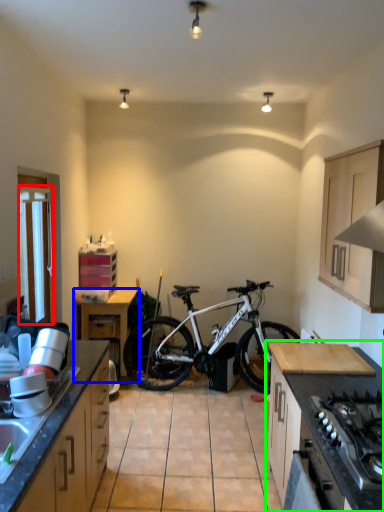
Question: Estimate the real-world distances between objects in this image. Which object is closer to window screen (highlighted by a red box), table (highlighted by a blue box) or cabinetry (highlighted by a green box)?

Choices:
 (A) table
 (B) cabinetry

Answer: (A)